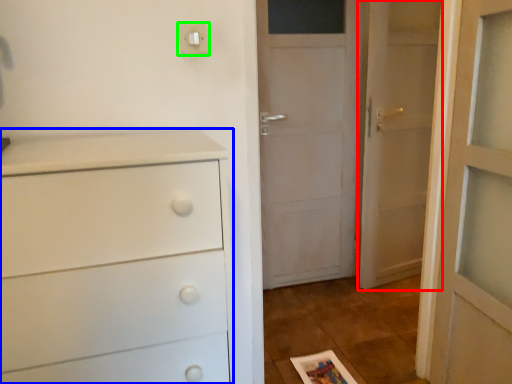
Question: Which object is the closest to the door (highlighted by a red box)? Choose among these: chest of drawers (highlighted by a blue box) or light switch (highlighted by a green box).

Choices:
 (A) chest of drawers
 (B) light switch

Answer: (B)